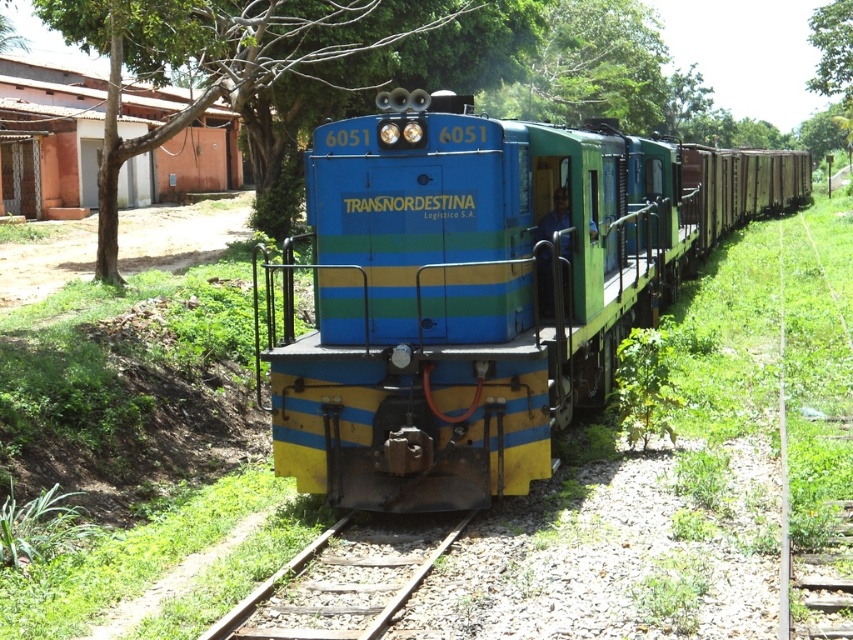
Which of these two, green leafy tree at center or rusty metal train track at center, stands shorter?

With less height is rusty metal train track at center.

Is point (108, 186) in front of point (454, 532)?

No, (108, 186) is behind (454, 532).

Where is `green leafy tree at center`? This screenshot has width=853, height=640. green leafy tree at center is located at coordinates (250, 58).

Between blue glossy train at center and green leafy tree at center, which one appears on the left side from the viewer's perspective?

Positioned to the left is green leafy tree at center.

Between blue glossy train at center and green leafy tree at center, which one has less height?

Standing shorter between the two is blue glossy train at center.

Is point (314, 472) positioned behind point (154, 29)?

No, it is not.

Locate an element on the screen. This screenshot has height=640, width=853. blue glossy train at center is located at coordinates (480, 289).

Is blue glossy train at center smaller than rusty metal train track at center?

No.

Is blue glossy train at center bigger than rusty metal train track at center?

Yes.

Measure the distance between blue glossy train at center and camera.

They are 6.62 meters apart.

Find the location of a particular element. blue glossy train at center is located at coordinates (480, 289).